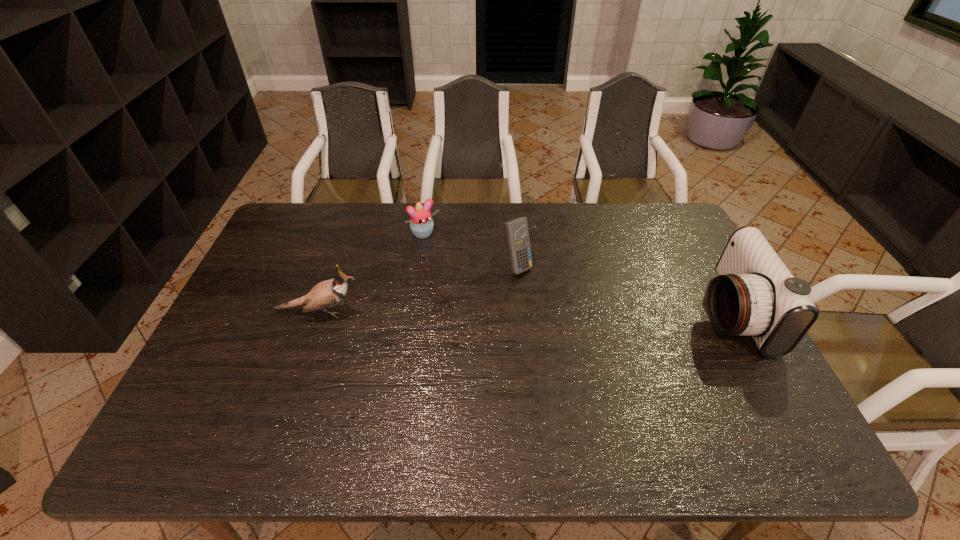
The image size is (960, 540). Find the location of `free space on the desktop that is between the bird and the rightmost object and is positioned on the face of the third object from right to left`. free space on the desktop that is between the bird and the rightmost object and is positioned on the face of the third object from right to left is located at coordinates (488, 312).

Find the location of a particular element. Image resolution: width=960 pixels, height=540 pixels. free space on the desktop that is between the bird and the camcorder and is positioned on the front-facing side of the second object from right to left is located at coordinates (571, 312).